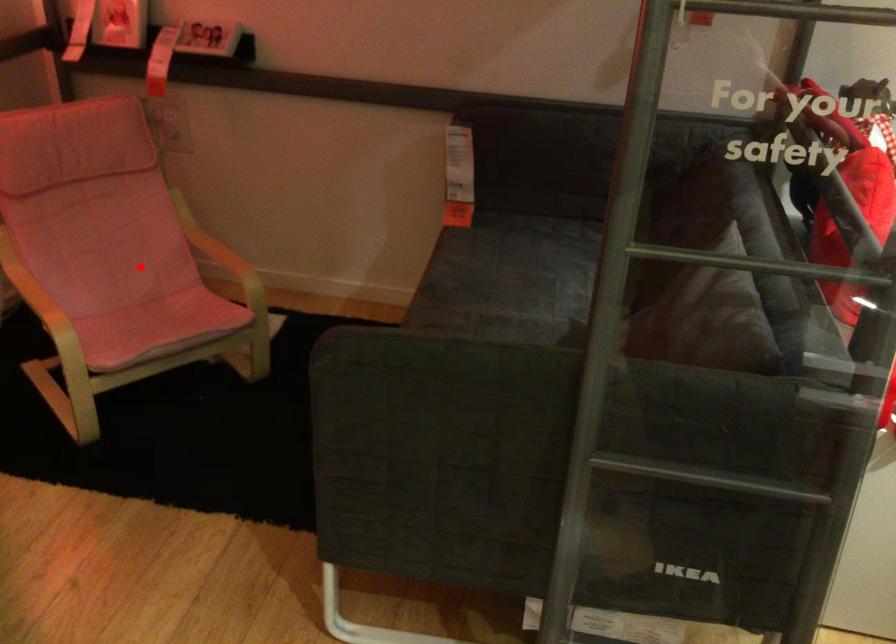
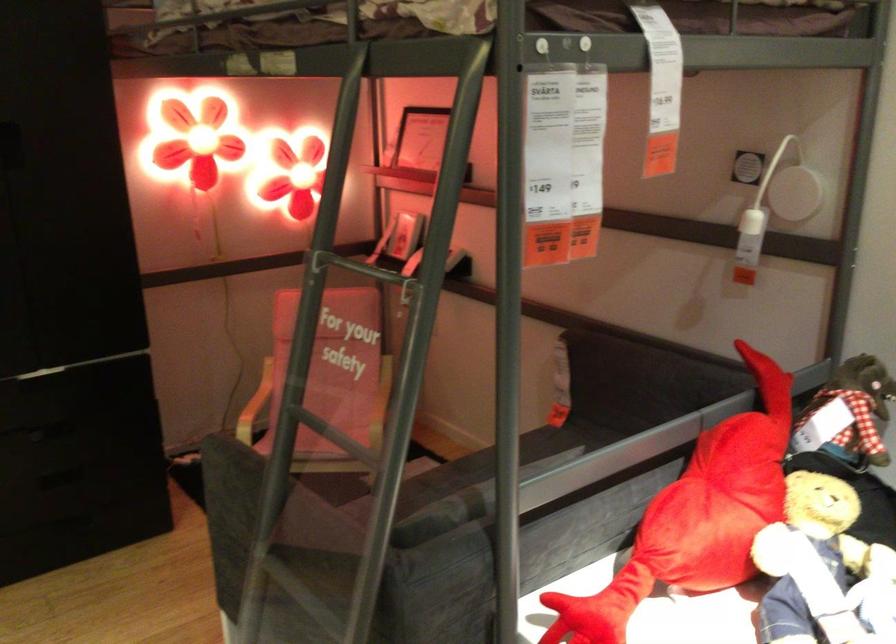
Question: I am providing you with two images of the same scene from different viewpoints. Image1 has a red point marked. In image2, the corresponding 3D location appears at what relative position? Reply with the corresponding letter.

Choices:
 (A) Closer
 (B) Farther

Answer: (B)